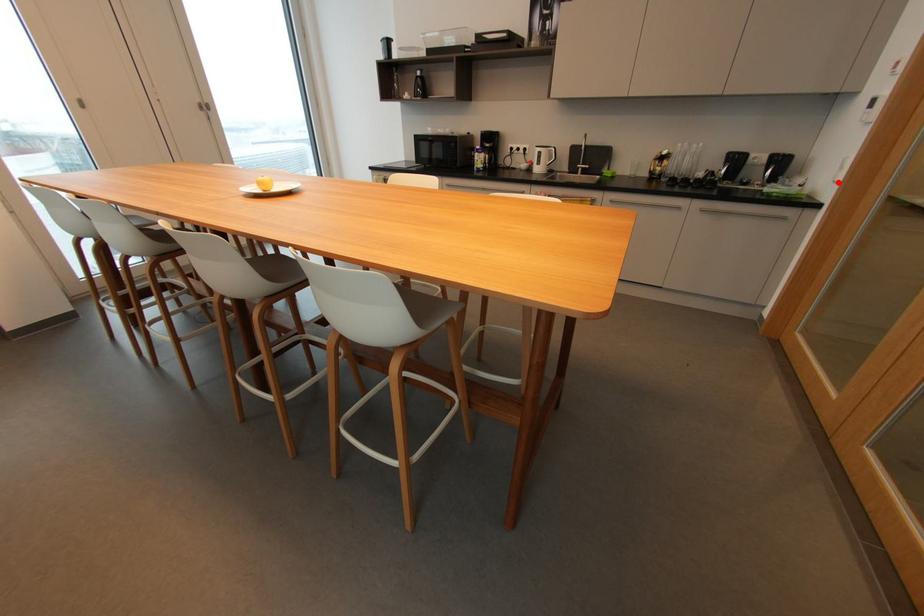
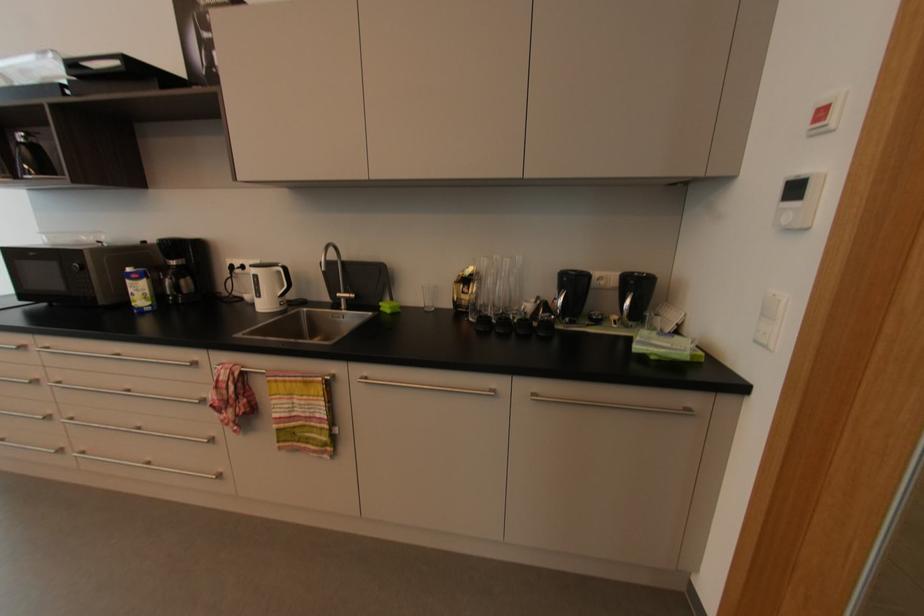
The point at the highlighted location is marked in the first image. Where is the corresponding point in the second image?

(769, 347)